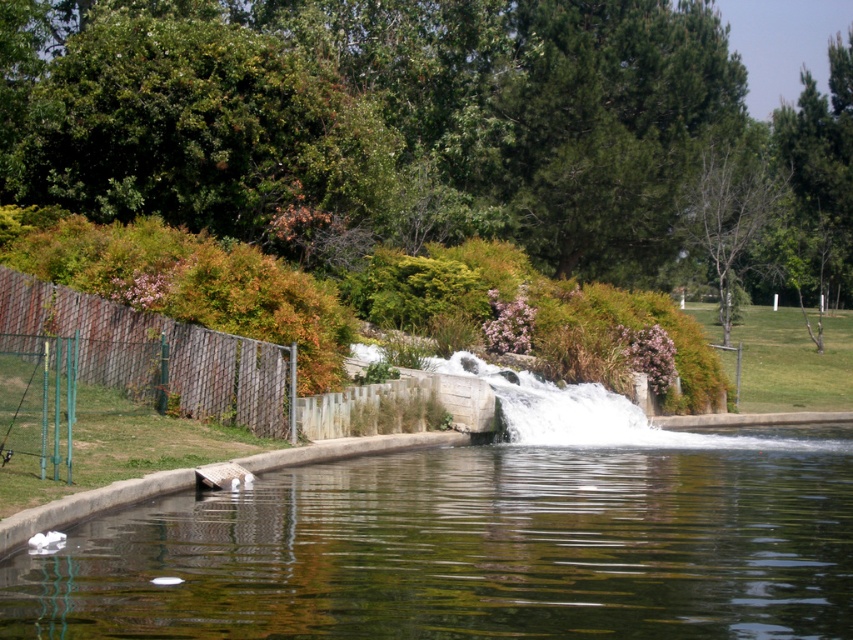
Question: Can you confirm if clear water at center is smaller than brown mesh fence at left?

Choices:
 (A) no
 (B) yes

Answer: (A)

Question: Which of the following is the farthest from the observer?

Choices:
 (A) clear water at center
 (B) brown mesh fence at left

Answer: (B)

Question: Can you confirm if clear water at center is thinner than brown mesh fence at left?

Choices:
 (A) no
 (B) yes

Answer: (A)

Question: Can you confirm if clear water at center is positioned to the left of brown mesh fence at left?

Choices:
 (A) no
 (B) yes

Answer: (A)

Question: Which of the following is the closest to the observer?

Choices:
 (A) (4, 268)
 (B) (773, 525)

Answer: (B)